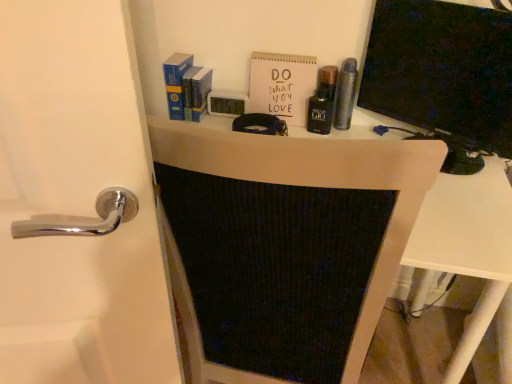
Identify the location of vacant area that is in front of matte black monitor at right. (461, 215).